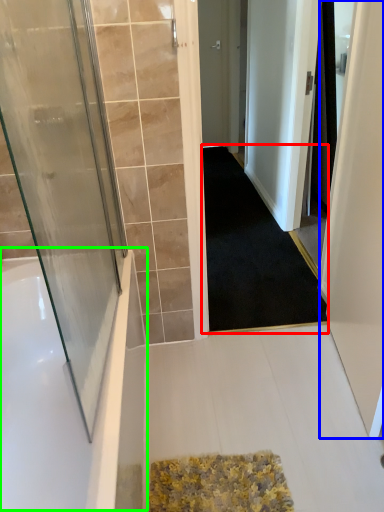
Question: Which object is positioned closest to doormat (highlighted by a red box)? Select from screen door (highlighted by a blue box) and bath (highlighted by a green box).

Choices:
 (A) screen door
 (B) bath

Answer: (A)